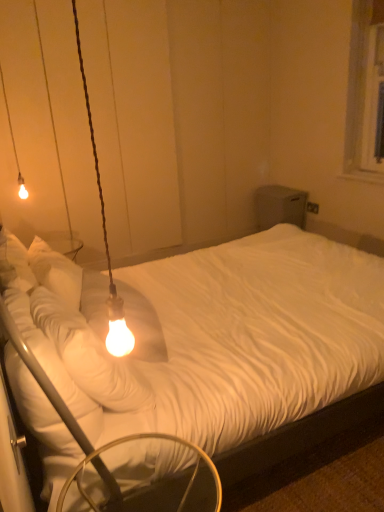
Question: Is metallic silver swivel chair at lower left thinner than matte glass bulb at left, the first lamp positioned from the bottom?

Choices:
 (A) no
 (B) yes

Answer: (A)

Question: From the image's perspective, would you say metallic silver swivel chair at lower left is shown under matte glass bulb at left, which is counted as the first lamp, starting from the front?

Choices:
 (A) yes
 (B) no

Answer: (A)

Question: From a real-world perspective, is metallic silver swivel chair at lower left physically above matte glass bulb at left, marked as the second lamp in a left-to-right arrangement?

Choices:
 (A) yes
 (B) no

Answer: (B)

Question: Considering the relative sizes of metallic silver swivel chair at lower left and matte glass bulb at left, the first lamp positioned from the bottom, in the image provided, is metallic silver swivel chair at lower left smaller than matte glass bulb at left, the first lamp positioned from the bottom,?

Choices:
 (A) no
 (B) yes

Answer: (A)

Question: Is metallic silver swivel chair at lower left not inside matte glass bulb at left, marked as the second lamp in a left-to-right arrangement?

Choices:
 (A) no
 (B) yes

Answer: (B)

Question: Is metallic silver swivel chair at lower left at the right side of matte glass bulb at left, marked as the second lamp in a left-to-right arrangement?

Choices:
 (A) yes
 (B) no

Answer: (A)

Question: Can you confirm if matte glass bulb at upper left, which appears as the 2th lamp when viewed from the front, is thinner than matte glass bulb at left, the first lamp positioned from the bottom?

Choices:
 (A) yes
 (B) no

Answer: (B)

Question: Is the surface of matte glass bulb at upper left, which appears as the first lamp when viewed from the left, in direct contact with matte glass bulb at left, marked as the second lamp in a left-to-right arrangement?

Choices:
 (A) no
 (B) yes

Answer: (A)

Question: Is matte glass bulb at upper left, the second lamp in the bottom-to-top sequence, positioned before matte glass bulb at left, positioned as the second lamp in back-to-front order?

Choices:
 (A) no
 (B) yes

Answer: (A)

Question: Would you say matte glass bulb at upper left, marked as the second lamp in a right-to-left arrangement, is outside matte glass bulb at left, which is counted as the first lamp, starting from the front?

Choices:
 (A) yes
 (B) no

Answer: (A)

Question: From the image's perspective, is matte glass bulb at upper left, which appears as the 2th lamp when viewed from the front, above matte glass bulb at left, which ranks as the second lamp in top-to-bottom order?

Choices:
 (A) no
 (B) yes

Answer: (B)

Question: Can you confirm if matte glass bulb at upper left, the second lamp in the bottom-to-top sequence, is positioned to the left of matte glass bulb at left, which is the 1th lamp in right-to-left order?

Choices:
 (A) no
 (B) yes

Answer: (B)

Question: Is metallic silver swivel chair at lower left smaller than matte glass bulb at upper left, the second lamp in the bottom-to-top sequence?

Choices:
 (A) yes
 (B) no

Answer: (B)